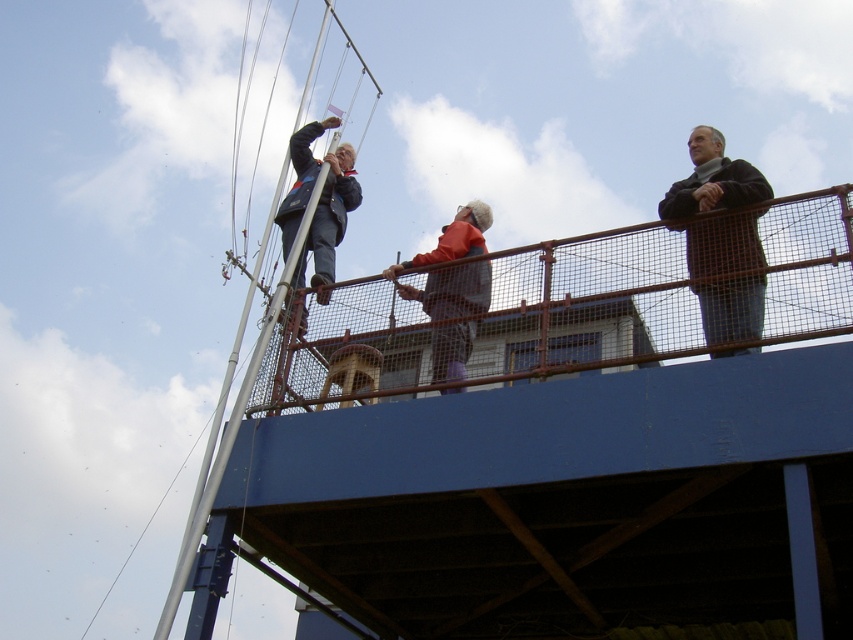
You are standing on the deck and need to reach the top of the metallic silver mast at upper left. The orange fabric jacket at center is blocking your path. Can you step over it?

The orange fabric jacket at center is shorter than the metallic silver mast at upper left, so you can step over it to reach the top of the mast.

You are standing on the platform and want to reach the dark blue jacket at upper left without touching the metallic silver mast at upper left. Is this possible?

The metallic silver mast at upper left is located below the dark blue jacket at upper left, so you can reach the dark blue jacket at upper left by going around the mast or stepping over it if possible, avoiding direct contact with the mast.